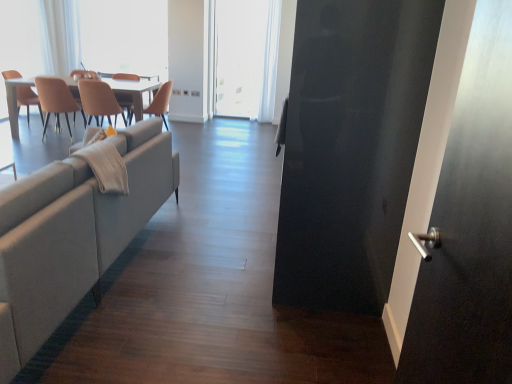
Question: Does white glossy table at upper left have a larger size compared to white sheer curtain at upper center?

Choices:
 (A) no
 (B) yes

Answer: (B)

Question: From the image's perspective, is white glossy table at upper left over white sheer curtain at upper center?

Choices:
 (A) yes
 (B) no

Answer: (B)

Question: Is white glossy table at upper left positioned with its back to white sheer curtain at upper center?

Choices:
 (A) yes
 (B) no

Answer: (B)

Question: Does white glossy table at upper left have a smaller size compared to white sheer curtain at upper center?

Choices:
 (A) yes
 (B) no

Answer: (B)

Question: Does white glossy table at upper left lie in front of white sheer curtain at upper center?

Choices:
 (A) yes
 (B) no

Answer: (A)

Question: Is matte beige chair at left, marked as the 3th chair in a right-to-left arrangement, to the left or to the right of matte beige chair at center, which is the 3th chair from left to right, in the image?

Choices:
 (A) right
 (B) left

Answer: (B)

Question: Considering their positions, is matte beige chair at left, marked as the 3th chair in a right-to-left arrangement, located in front of or behind matte beige chair at center, which is the 3th chair from left to right?

Choices:
 (A) front
 (B) behind

Answer: (B)

Question: From a real-world perspective, is matte beige chair at left, marked as the 3th chair in a right-to-left arrangement, physically located above or below matte beige chair at center, placed as the 2th chair when sorted from right to left?

Choices:
 (A) below
 (B) above

Answer: (A)

Question: Considering the positions of matte beige chair at left, marked as the 3th chair in a right-to-left arrangement, and matte beige chair at center, placed as the 2th chair when sorted from right to left, in the image, is matte beige chair at left, marked as the 3th chair in a right-to-left arrangement, taller or shorter than matte beige chair at center, placed as the 2th chair when sorted from right to left,?

Choices:
 (A) short
 (B) tall

Answer: (B)

Question: Based on their positions, is white glossy table at upper left located to the left or right of matte beige chair at center, which is the 3th chair from left to right?

Choices:
 (A) left
 (B) right

Answer: (A)

Question: In terms of size, does white glossy table at upper left appear bigger or smaller than matte beige chair at center, placed as the 2th chair when sorted from right to left?

Choices:
 (A) small
 (B) big

Answer: (B)

Question: Do you think white glossy table at upper left is within matte beige chair at center, placed as the 2th chair when sorted from right to left, or outside of it?

Choices:
 (A) outside
 (B) inside

Answer: (A)

Question: Is white glossy table at upper left in front of or behind matte beige chair at center, which is the 3th chair from left to right, in the image?

Choices:
 (A) behind
 (B) front

Answer: (A)

Question: Is transparent plastic window screen at upper left, the 1th window screen from the left, in front of or behind matte orange chair at left, the fourth chair in the right-to-left sequence, in the image?

Choices:
 (A) front
 (B) behind

Answer: (B)

Question: Is point (152, 74) closer or farther from the camera than point (16, 104)?

Choices:
 (A) farther
 (B) closer

Answer: (A)